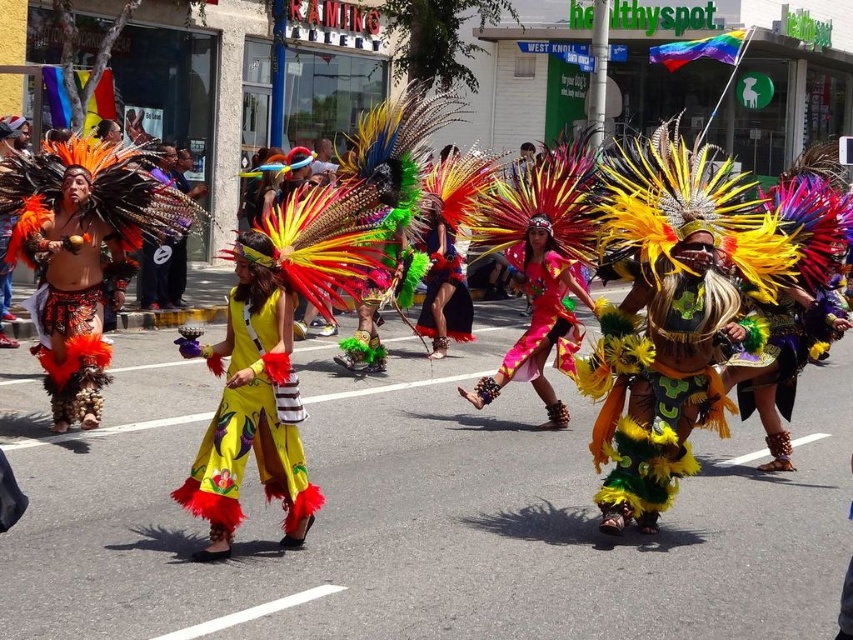
You are a photographer at the parade. You want to capture both the bright yellow feathered headdress at center and the pink satin dress at center in a single photo. Which object should you focus on first to ensure both are in frame?

The bright yellow feathered headdress at center is smaller than the pink satin dress at center. To ensure both are in frame, focus on the pink satin dress at center first since it is larger and will require more space in the photo.

In the parade scene, you notice two central items of clothing and decoration. The bright yellow feathered headdress at center and the pink satin dress at center. Which one is positioned more to the right side?

The bright yellow feathered headdress at center is to the right of the pink satin dress at center, so it is positioned more to the right side.

In the scene shown: You are a photographer at the parade. You want to capture a photo of the shiny pink fabric at center. Where should you aim your camera to ensure it is in the frame?

The shiny pink fabric at center is located at the coordinates point (544,316), so aim your camera there to capture it.